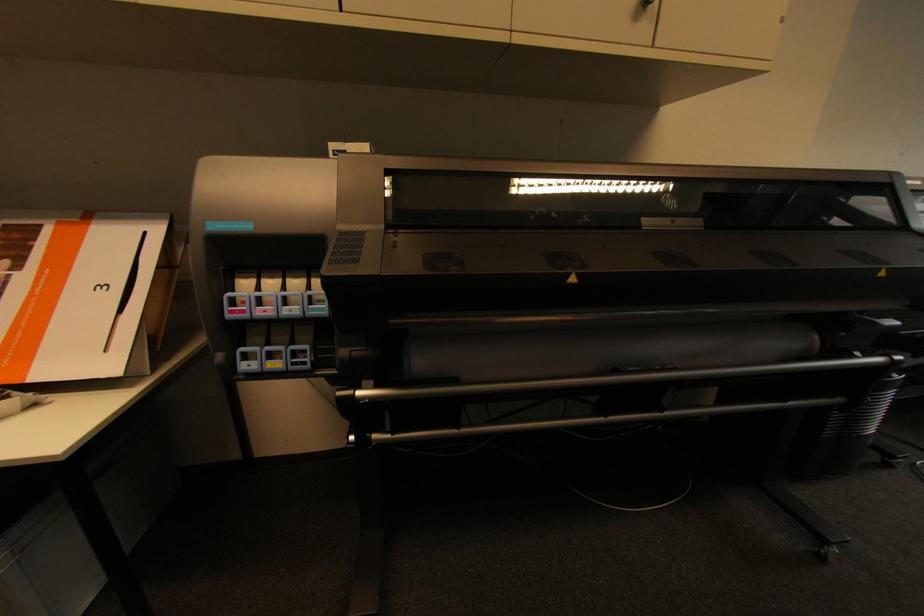
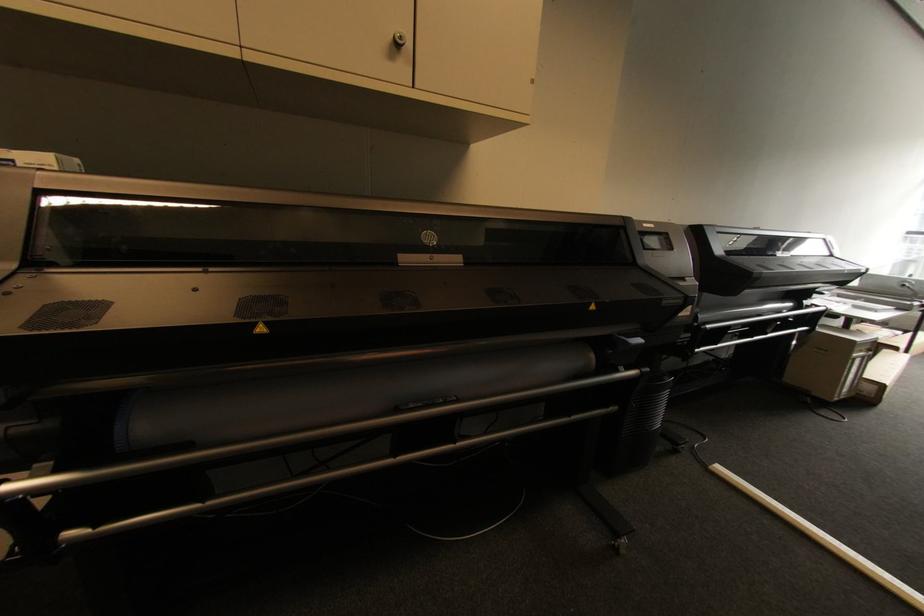
Question: The first image is from the beginning of the video and the second image is from the end. How did the camera likely rotate when shooting the video?

Choices:
 (A) Left
 (B) Right
 (C) Up
 (D) Down

Answer: (B)